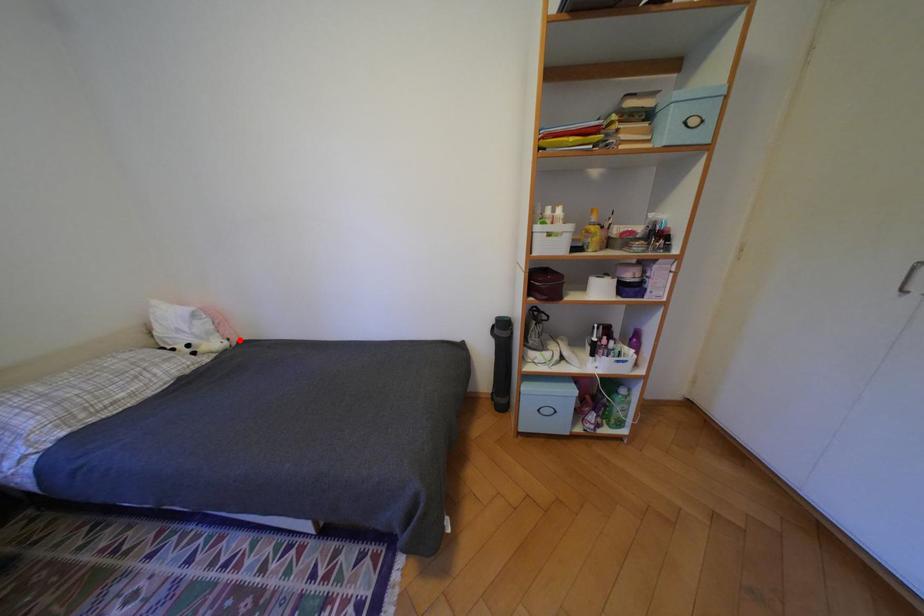
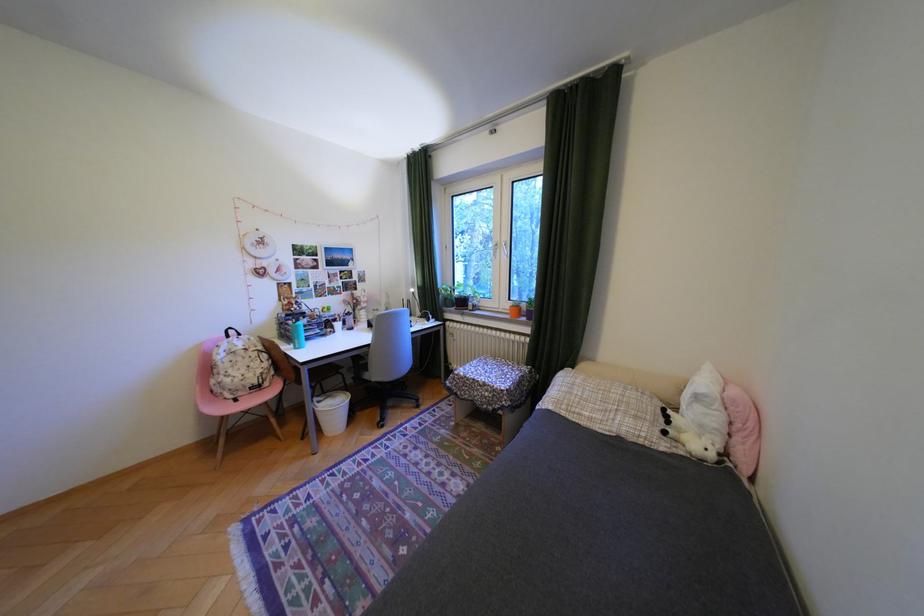
Find the pixel in the second image that matches the highlighted location in the first image.

(736, 455)